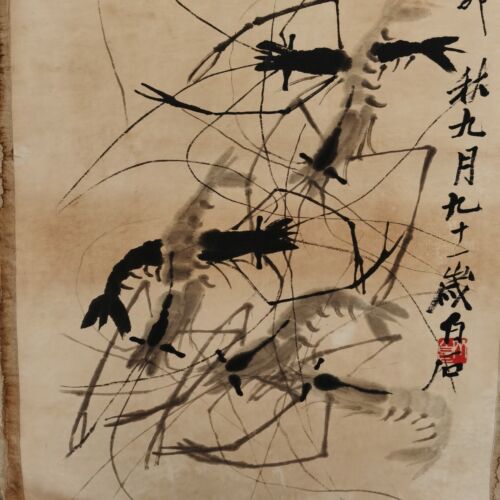
The height and width of the screenshot is (500, 500). I want to click on artwork on old paper, so click(x=300, y=224).